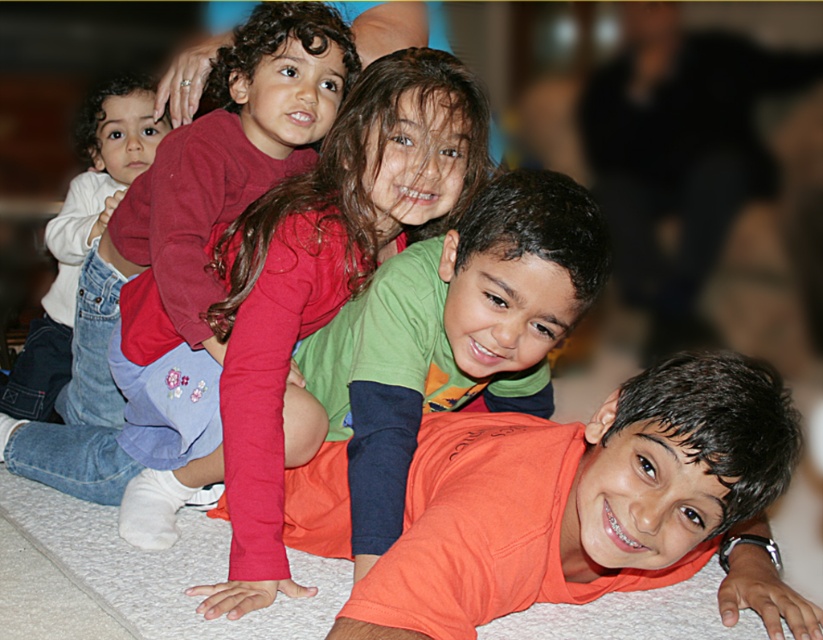
You are a photographer trying to capture a closeup of the matte red shirt at upper left and the white denim jeans at left. Which one should you focus on to ensure it appears clearer in the photo?

The matte red shirt at upper left is closer to the viewer than the white denim jeans at left, so focusing on the matte red shirt at upper left will ensure it appears clearer in the photo.

You are a photographer trying to capture a group photo of the orange cotton shirt at center and the white denim jeans at left. Based on their positions, which object should you focus on first if you want to ensure both are in frame?

The orange cotton shirt at center is positioned on the right side of white denim jeans at left. To ensure both are in frame, focus on the white denim jeans at left first since it is on the left side, then adjust to include the orange cotton shirt at center on the right.